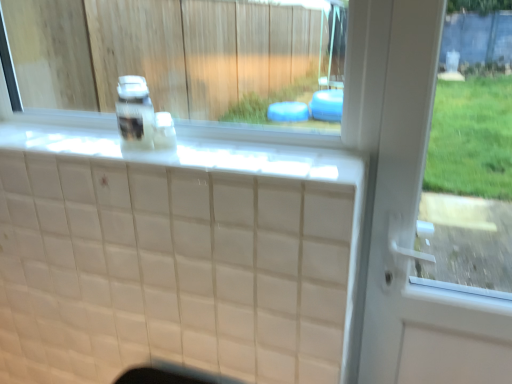
At what (x,y) coordinates should I click in order to perform the action: click on free space above white glossy ledge at upper center (from a real-world perspective). Please return your answer as a coordinate pair (x, y). The image size is (512, 384). Looking at the image, I should click on (136, 141).